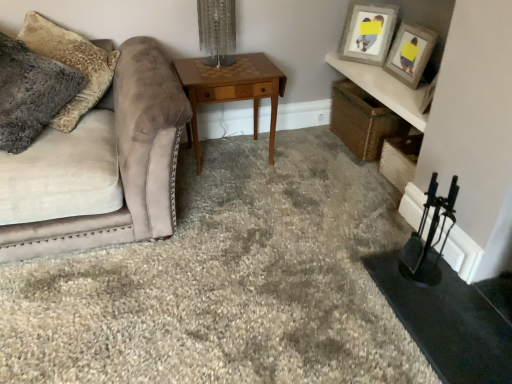
Question: Is suede couch at left inside matte gray picture frame at upper right, arranged as the 2th picture frame when viewed from the left?

Choices:
 (A) yes
 (B) no

Answer: (B)

Question: Is matte gray picture frame at upper right, the first picture frame positioned from the right, behind suede couch at left?

Choices:
 (A) no
 (B) yes

Answer: (B)

Question: Considering the relative sizes of matte gray picture frame at upper right, arranged as the 2th picture frame when viewed from the left, and suede couch at left in the image provided, is matte gray picture frame at upper right, arranged as the 2th picture frame when viewed from the left, thinner than suede couch at left?

Choices:
 (A) no
 (B) yes

Answer: (B)

Question: From a real-world perspective, is matte gray picture frame at upper right, arranged as the 2th picture frame when viewed from the left, positioned under suede couch at left based on gravity?

Choices:
 (A) no
 (B) yes

Answer: (A)

Question: Is there a large distance between matte gray picture frame at upper right, the first picture frame positioned from the right, and suede couch at left?

Choices:
 (A) yes
 (B) no

Answer: (A)

Question: From a real-world perspective, is matte gray picture frame at upper right, arranged as the 2th picture frame when viewed from the left, over suede couch at left?

Choices:
 (A) yes
 (B) no

Answer: (A)

Question: Would you say suede couch at left is outside woodenobject at center?

Choices:
 (A) yes
 (B) no

Answer: (A)

Question: Could you tell me if suede couch at left is facing woodenobject at center?

Choices:
 (A) yes
 (B) no

Answer: (B)

Question: Does suede couch at left have a larger size compared to woodenobject at center?

Choices:
 (A) no
 (B) yes

Answer: (B)

Question: Are suede couch at left and woodenobject at center located far from each other?

Choices:
 (A) no
 (B) yes

Answer: (A)

Question: Is woodenobject at center surrounded by suede couch at left?

Choices:
 (A) yes
 (B) no

Answer: (B)

Question: From the image's perspective, is suede couch at left under woodenobject at center?

Choices:
 (A) no
 (B) yes

Answer: (B)

Question: From the image's perspective, is matte gray picture frame at upper right, the first picture frame positioned from the right, below fuzzy gray pillow at left?

Choices:
 (A) yes
 (B) no

Answer: (B)